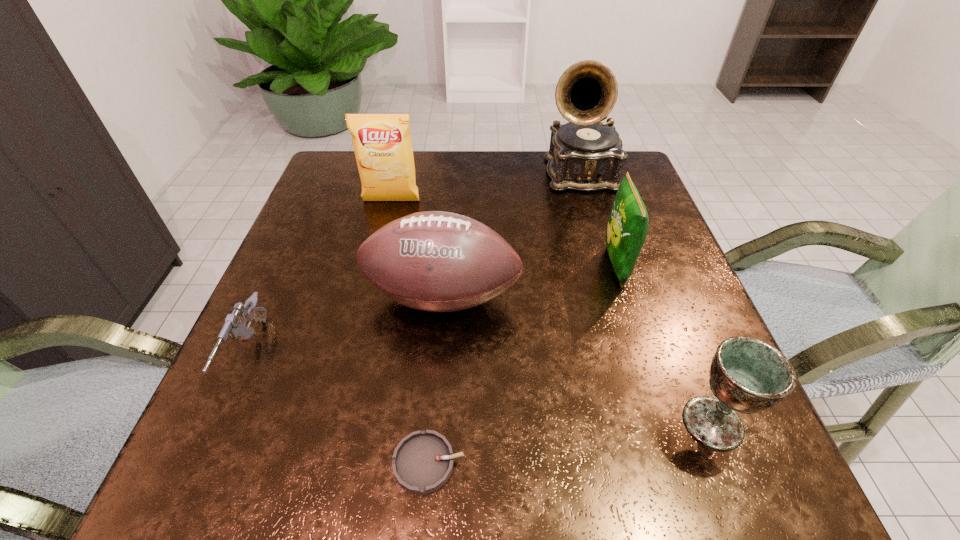
This screenshot has width=960, height=540. In order to click on crisp (potato chip) located at the far edge in this screenshot , I will do `click(382, 143)`.

Find the location of a particular element. The image size is (960, 540). chalice present at the near edge is located at coordinates (747, 375).

In order to click on ashtray that is at the near edge in this screenshot , I will do pos(423,461).

Where is `crisp (potato chip) present at the left edge`? The image size is (960, 540). crisp (potato chip) present at the left edge is located at coordinates (382, 143).

At what (x,y) coordinates should I click in order to perform the action: click on gun that is at the left edge. Please return your answer as a coordinate pair (x, y). Looking at the image, I should click on (235, 324).

This screenshot has height=540, width=960. I want to click on phonograph record that is at the right edge, so click(585, 154).

This screenshot has height=540, width=960. What are the coordinates of `crisp (potato chip) that is at the right edge` in the screenshot? It's located at (627, 228).

The height and width of the screenshot is (540, 960). In order to click on chalice situated at the right edge in this screenshot , I will do pos(747,375).

At what (x,y) coordinates should I click in order to perform the action: click on object at the far left corner. Please return your answer as a coordinate pair (x, y). Looking at the image, I should click on (382, 143).

Where is `object located at the far right corner`? This screenshot has width=960, height=540. object located at the far right corner is located at coordinates (585, 154).